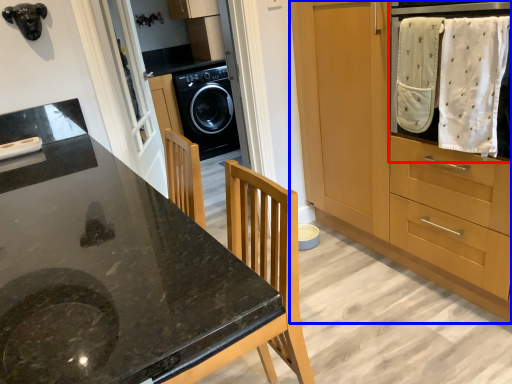
Question: Among these objects, which one is nearest to the camera, home appliance (highlighted by a red box) or cabinetry (highlighted by a blue box)?

Choices:
 (A) home appliance
 (B) cabinetry

Answer: (B)